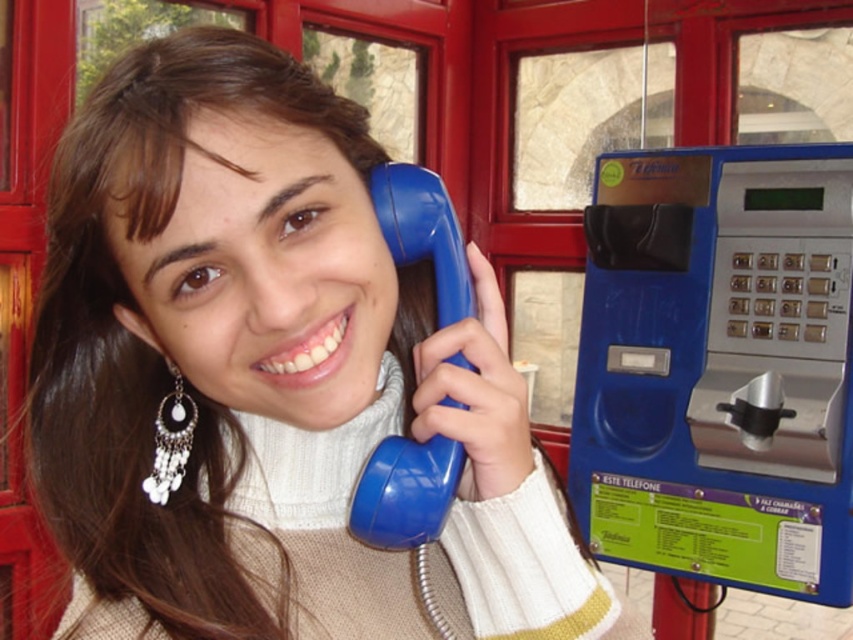
From the picture: You are designing a new phone booth and need to ensure the phone inside fits properly. Given the scene, which object is wider, the matte blue phone at center or the blue plastic phone box at right?

The matte blue phone at center is wider than the blue plastic phone box at right according to the description.